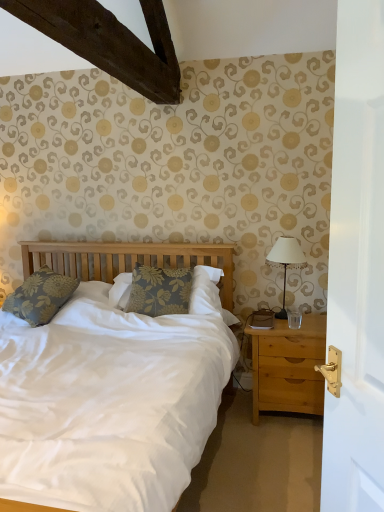
Question: Visually, is white fabric-covered lamp at right positioned to the left or to the right of floral fabric pillow at left, which is counted as the first pillow, starting from the left?

Choices:
 (A) right
 (B) left

Answer: (A)

Question: From a real-world perspective, is white fabric-covered lamp at right physically located above or below floral fabric pillow at left, which is counted as the first pillow, starting from the left?

Choices:
 (A) below
 (B) above

Answer: (B)

Question: Which object is positioned farthest from the light brown wood nightstand at right?

Choices:
 (A) transparent glass at right
 (B) floral fabric pillow at left, the second pillow positioned from the right
 (C) white fabric-covered lamp at right
 (D) floral fabric pillow at center, the 1th pillow from the right

Answer: (B)

Question: Considering the real-world distances, which object is closest to the light brown wood nightstand at right?

Choices:
 (A) transparent glass at right
 (B) white fabric-covered lamp at right
 (C) floral fabric pillow at left, the second pillow positioned from the right
 (D) floral fabric pillow at center, the 1th pillow from the right

Answer: (A)